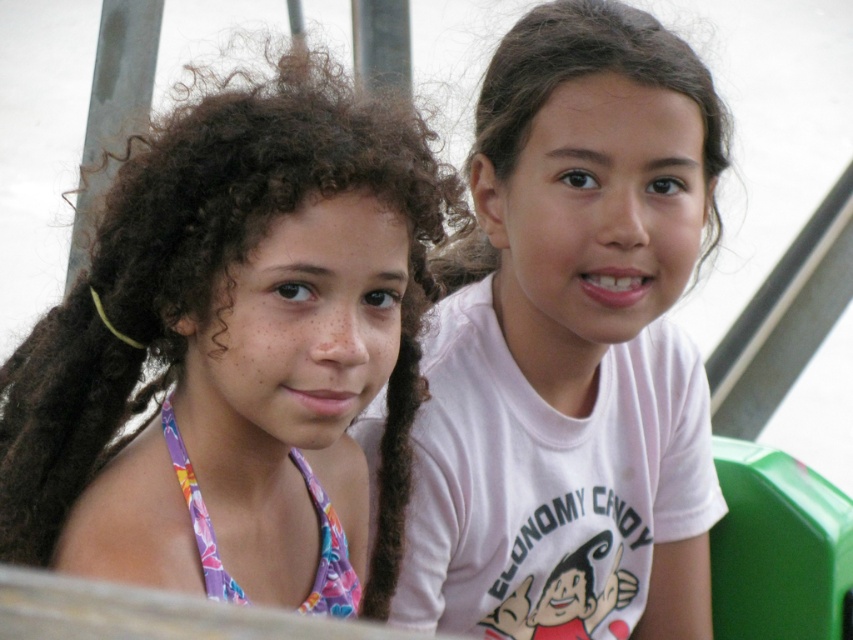
The height and width of the screenshot is (640, 853). What do you see at coordinates (231, 339) in the screenshot? I see `matte purple swimsuit at left` at bounding box center [231, 339].

Who is more forward, [178,422] or [318,592]?

Point [178,422] is in front.

The width and height of the screenshot is (853, 640). Identify the location of matte purple swimsuit at left. (231, 339).

In order to click on matte purple swimsuit at left in this screenshot , I will do `click(231, 339)`.

Between matte purple swimsuit at left and white matte shirt at center, which one is positioned lower?

matte purple swimsuit at left is below.

Based on the photo, who is taller, matte purple swimsuit at left or white matte shirt at center?

With more height is white matte shirt at center.

Find the location of a particular element. The image size is (853, 640). matte purple swimsuit at left is located at coordinates (231, 339).

Who is more distant from viewer, [544,429] or [308,600]?

Point [544,429]

Is point (566, 26) more distant than point (318, 589)?

Yes, point (566, 26) is farther from viewer.

This screenshot has width=853, height=640. In order to click on white matte shirt at center in this screenshot , I will do `click(572, 348)`.